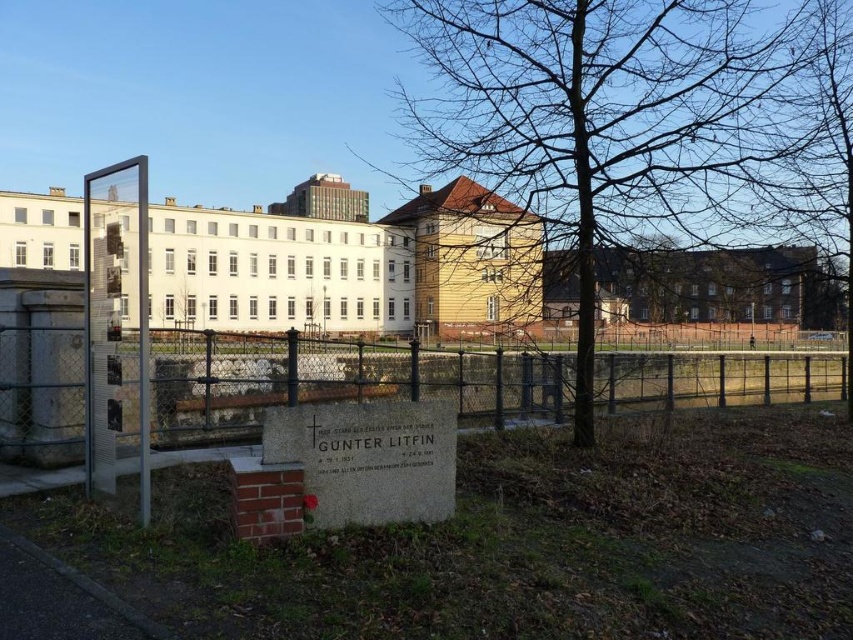
Which is more to the right, bare branches at center or metallic chain-link fence at center?

From the viewer's perspective, metallic chain-link fence at center appears more on the right side.

Is point (469, 128) positioned before point (192, 422)?

That is True.

Is point (724, 116) farther from viewer compared to point (125, 368)?

That is True.

Locate an element on the screen. This screenshot has height=640, width=853. bare branches at center is located at coordinates (608, 116).